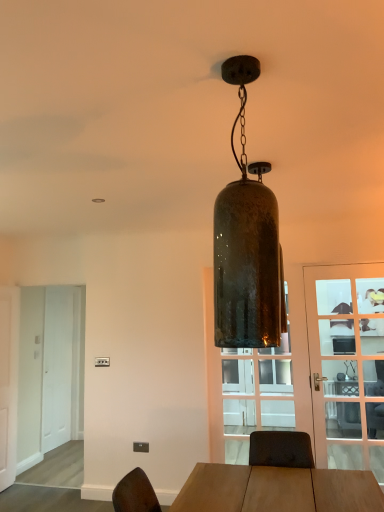
Question: Is green glass pendant light at center not near transparent glass door at center?

Choices:
 (A) no
 (B) yes

Answer: (B)

Question: Is green glass pendant light at center outside of transparent glass door at center?

Choices:
 (A) no
 (B) yes

Answer: (B)

Question: Is green glass pendant light at center positioned in front of transparent glass door at center?

Choices:
 (A) yes
 (B) no

Answer: (A)

Question: Can you confirm if green glass pendant light at center is thinner than transparent glass door at center?

Choices:
 (A) yes
 (B) no

Answer: (B)

Question: Considering the relative positions of green glass pendant light at center and transparent glass door at center in the image provided, is green glass pendant light at center to the right of transparent glass door at center from the viewer's perspective?

Choices:
 (A) no
 (B) yes

Answer: (A)

Question: Considering the relative sizes of green glass pendant light at center and transparent glass door at center in the image provided, is green glass pendant light at center smaller than transparent glass door at center?

Choices:
 (A) yes
 (B) no

Answer: (A)

Question: Is white matte door at left, the 2th door viewed from the right, aimed at transparent glass door at center?

Choices:
 (A) no
 (B) yes

Answer: (B)

Question: From a real-world perspective, is white matte door at left, which appears as the first door when viewed from the back, beneath transparent glass door at center?

Choices:
 (A) yes
 (B) no

Answer: (A)

Question: Is white matte door at left, the 1th door from the left, bigger than transparent glass door at center?

Choices:
 (A) yes
 (B) no

Answer: (B)

Question: Is white matte door at left, marked as the second door in a front-to-back arrangement, behind transparent glass door at center?

Choices:
 (A) yes
 (B) no

Answer: (A)

Question: Considering the relative sizes of white matte door at left, the 2th door viewed from the right, and transparent glass door at center in the image provided, is white matte door at left, the 2th door viewed from the right, thinner than transparent glass door at center?

Choices:
 (A) no
 (B) yes

Answer: (A)

Question: Is transparent glass door at center located within white matte door at left, the 2th door viewed from the right?

Choices:
 (A) yes
 (B) no

Answer: (B)

Question: Is green glass pendant light at center facing away from white matte door at left, which appears as the first door when viewed from the back?

Choices:
 (A) yes
 (B) no

Answer: (B)